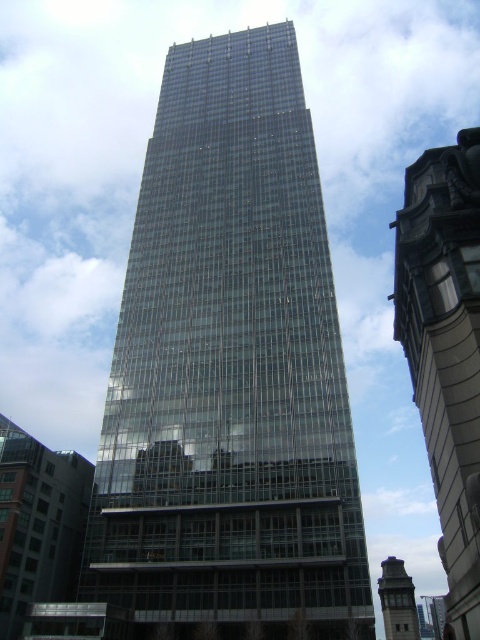
Describe the element at coordinates (445, 349) in the screenshot. I see `glassy steel skyscraper at center` at that location.

Which is below, glassy steel skyscraper at center or transparent glass building at center?

transparent glass building at center is below.

This screenshot has height=640, width=480. In order to click on glassy steel skyscraper at center in this screenshot , I will do `click(445, 349)`.

Who is shorter, transparent glass building at center or gray concrete clock tower at lower right?

With less height is transparent glass building at center.

Locate an element on the screen. This screenshot has height=640, width=480. transparent glass building at center is located at coordinates (37, 524).

Is glassy steel skyscraper at center positioned in front of gray concrete clock tower at lower right?

Yes, glassy steel skyscraper at center is closer to the viewer.

Can you confirm if glassy steel skyscraper at center is positioned to the left of gray concrete clock tower at lower right?

Yes, glassy steel skyscraper at center is to the left of gray concrete clock tower at lower right.

Between point (456, 404) and point (408, 611), which one is positioned behind?

Positioned behind is point (408, 611).

Locate an element on the screen. glassy steel skyscraper at center is located at coordinates coord(445,349).